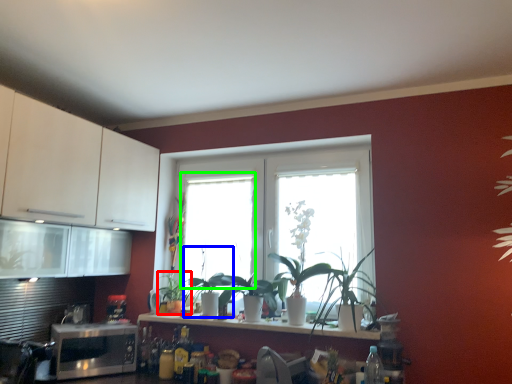
Question: Estimate the real-world distances between objects in this image. Which object is farther from plant (highlighted by a red box), plant (highlighted by a blue box) or window (highlighted by a green box)?

Choices:
 (A) plant
 (B) window

Answer: (B)